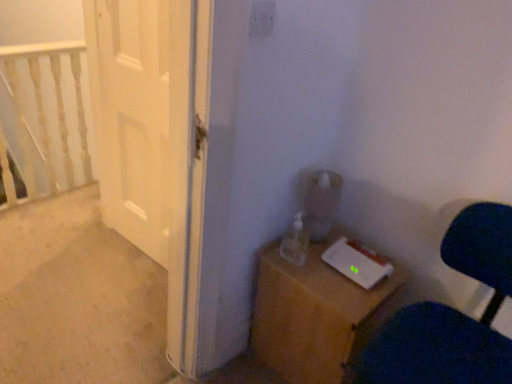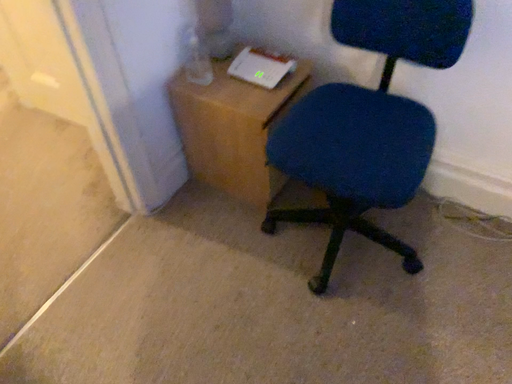
Question: How did the camera likely rotate when shooting the video?

Choices:
 (A) rotated downward
 (B) rotated upward

Answer: (A)